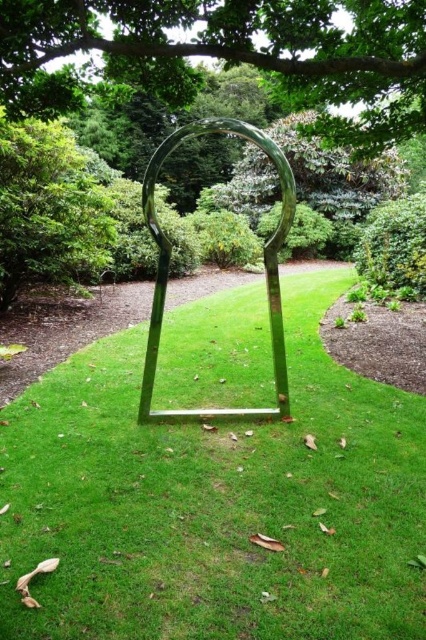
Which is above, green leafy tree at center or polished metal arch at center?

Result: green leafy tree at center is above.

Is green leafy tree at center positioned in front of polished metal arch at center?

No.

Who is more forward, (x=17, y=275) or (x=285, y=364)?

Point (x=285, y=364) is in front.

Locate an element on the screen. This screenshot has height=640, width=426. green leafy tree at center is located at coordinates (48, 209).

Does point (71, 449) come in front of point (360, 28)?

Yes, it is.

Based on the photo, does green metallic frame at center lie in front of green leafy tree at upper center?

Yes, green metallic frame at center is closer to the viewer.

Is point (388, 598) behind point (31, 60)?

No, (388, 598) is in front of (31, 60).

At what (x,y) coordinates should I click in order to perform the action: click on green metallic frame at center. Please return your answer as a coordinate pair (x, y). The width and height of the screenshot is (426, 640). Looking at the image, I should click on (215, 502).

Locate an element on the screen. green leafy tree at upper center is located at coordinates (229, 52).

Which is more to the left, green leafy tree at upper center or green leafy tree at center?

green leafy tree at center

Between point (296, 20) and point (52, 211), which one is positioned in front?

Point (296, 20) is in front.

You are a GUI agent. You are given a task and a screenshot of the screen. Output one action in this format:
    pyautogui.click(x=<x>, y=<y>)
    Task: Click on the green leafy tree at upper center
    The height and width of the screenshot is (640, 426).
    Given the screenshot: What is the action you would take?
    pyautogui.click(x=229, y=52)